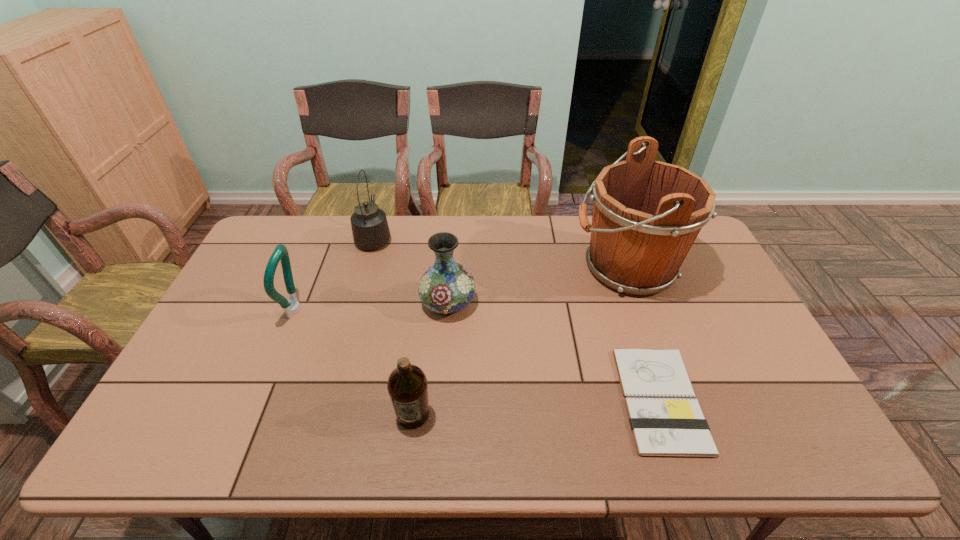
Identify the location of free space located at the jaws of the bottle opener. (369, 309).

What are the coordinates of `blank area located on the label of the olive oil` in the screenshot? It's located at (409, 452).

The height and width of the screenshot is (540, 960). I want to click on vacant region located 0.240m on the left of the notepad, so click(x=527, y=399).

The image size is (960, 540). Find the location of `bucket that is at the far edge`. bucket that is at the far edge is located at coordinates (647, 214).

This screenshot has width=960, height=540. I want to click on kettle located at the far edge, so tap(370, 229).

You are a GUI agent. You are given a task and a screenshot of the screen. Output one action in this format:
    pyautogui.click(x=<x>, y=<y>)
    Task: Click on the olive oil that is at the near edge
    The image size is (960, 540).
    Given the screenshot: What is the action you would take?
    point(407,385)

Where is `notepad present at the near edge`? Image resolution: width=960 pixels, height=540 pixels. notepad present at the near edge is located at coordinates (663, 423).

Where is `object that is positioned at the right edge`? This screenshot has height=540, width=960. object that is positioned at the right edge is located at coordinates (647, 214).

Locate an element on the screen. This screenshot has width=960, height=540. object present at the far right corner is located at coordinates (647, 214).

Locate an element on the screen. The height and width of the screenshot is (540, 960). vacant region at the near edge of the desktop is located at coordinates (373, 458).